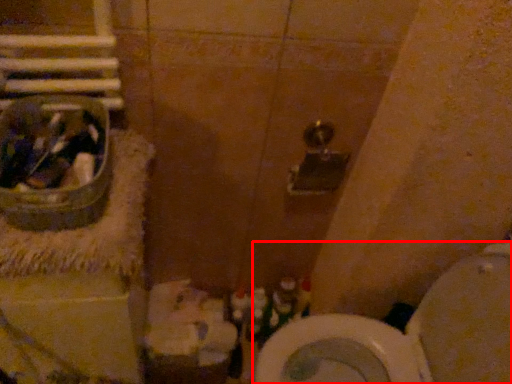
Question: Observing the image, what is the correct spatial positioning of toilet (annotated by the red box) in reference to sink?

Choices:
 (A) right
 (B) left

Answer: (A)